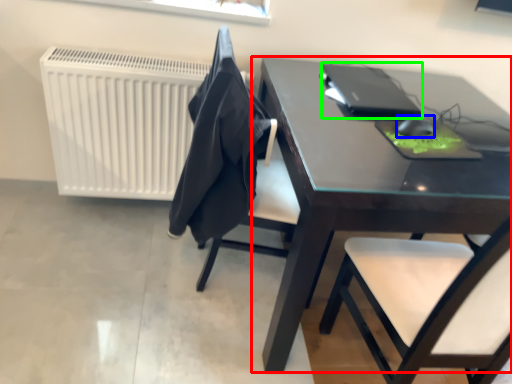
Question: Which object is the farthest from table (highlighted by a red box)? Choose among these: mouse (highlighted by a blue box) or laptop (highlighted by a green box).

Choices:
 (A) mouse
 (B) laptop

Answer: (A)